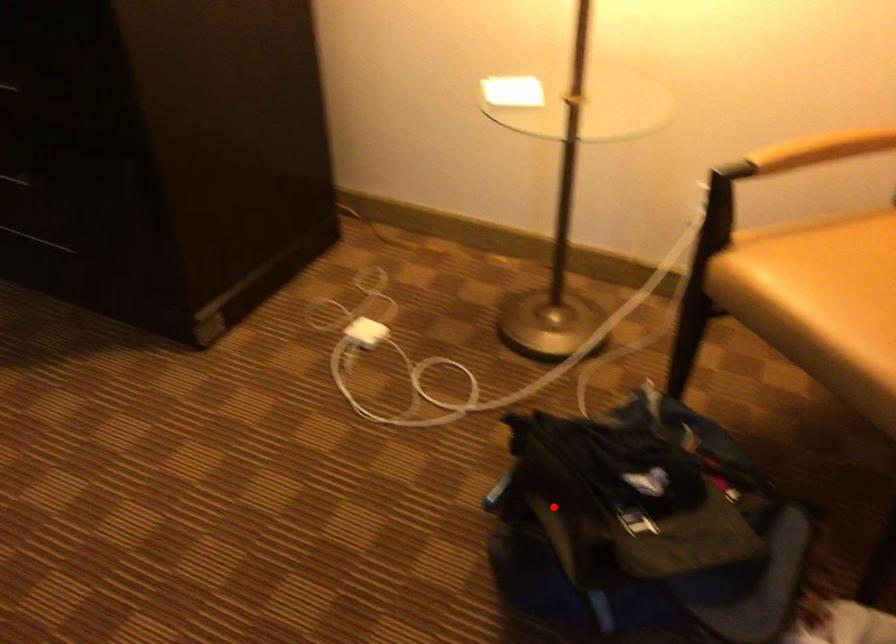
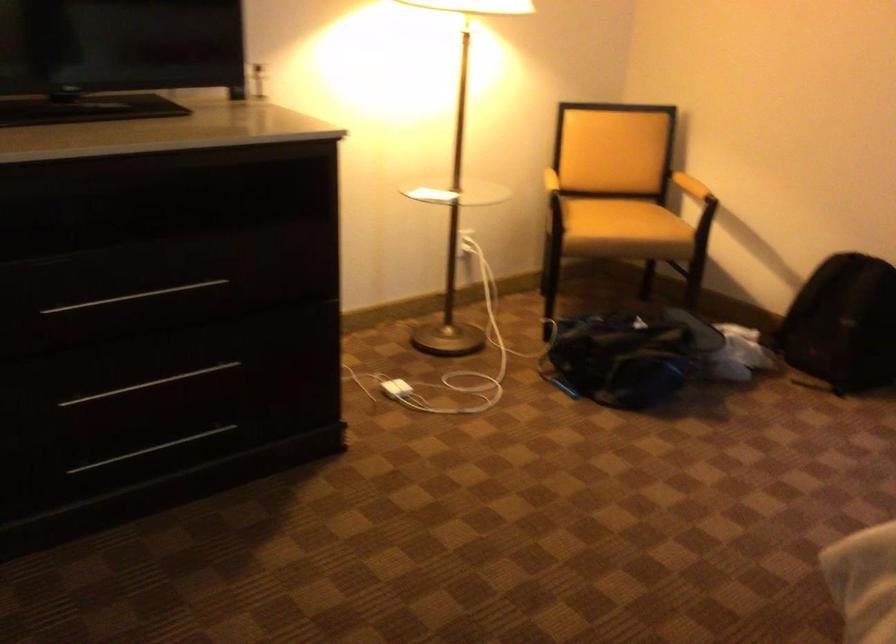
In the second image, find the point that corresponds to the highlighted location in the first image.

(627, 355)